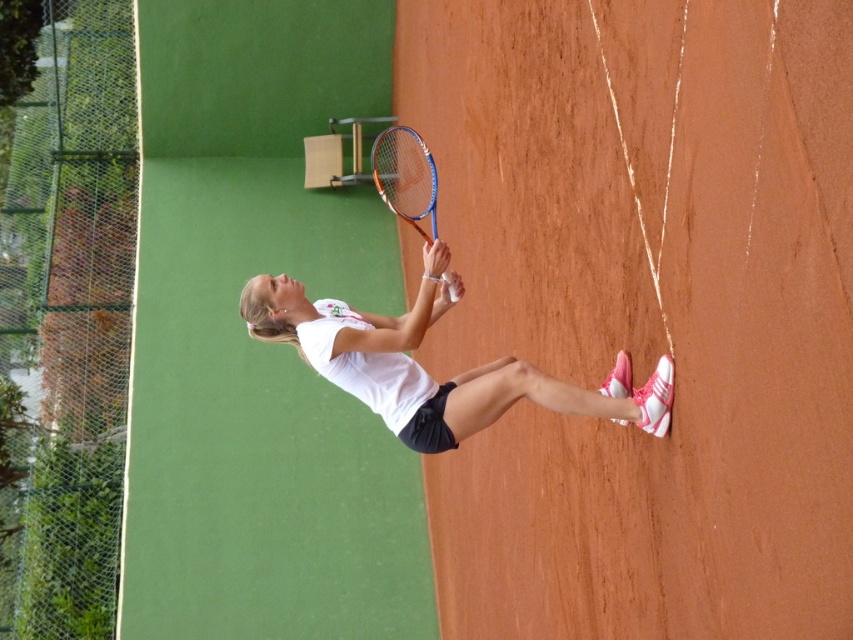
You are a tennis coach observing a player holding two rackets during a practice session. The player is holding the white matte tennis racket at center and the orange metallic tennis racket at center. Which racket is placed below the other?

The white matte tennis racket at center is positioned under the orange metallic tennis racket at center, so the white one is below the orange one.

You are a tennis coach observing a player holding two rackets, the white matte tennis racket at center and the orange metallic tennis racket at center. Which racket is taller?

The white matte tennis racket at center is taller than the orange metallic tennis racket at center.

You are a tennis coach observing two players practicing on the clay court. You notice both players have a racket. One has a white matte tennis racket at center and the other has an orange metallic tennis racket at center. Which racket is positioned more to the right?

The white matte tennis racket at center is positioned more to the right than the orange metallic tennis racket at center.